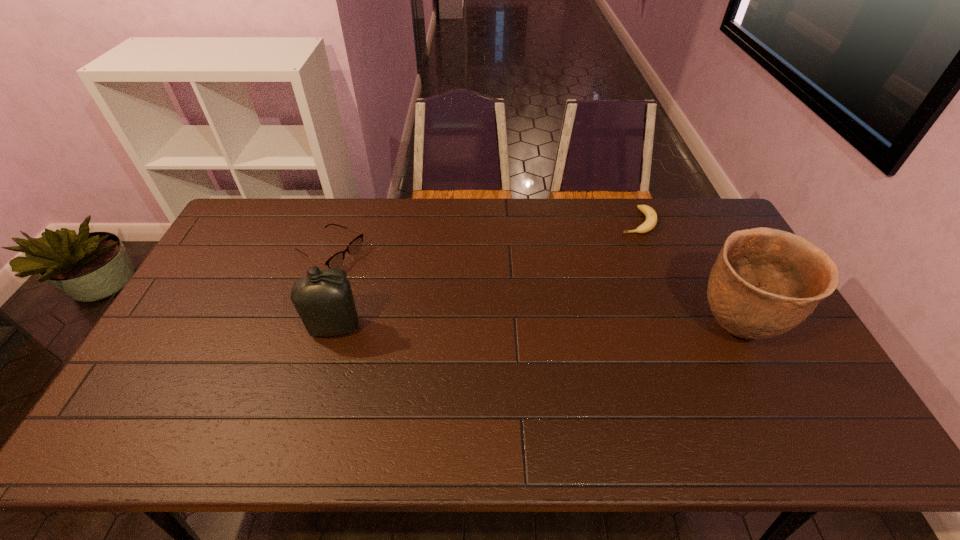
In order to click on free space on the desktop that is between the bottle and the pottery and is positioned on the face of the spectacles in this screenshot , I will do `click(477, 328)`.

At what (x,y) coordinates should I click in order to perform the action: click on free space on the desktop that is between the third shortest object and the pottery and is positioned at the stem of the banana. Please return your answer as a coordinate pair (x, y). The image size is (960, 540). Looking at the image, I should click on (587, 328).